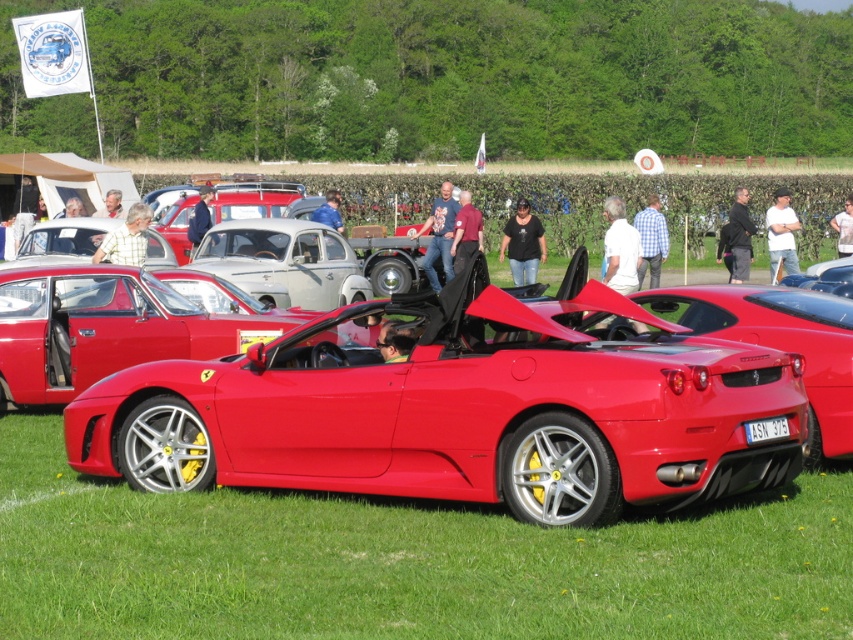
You are a photographer at the car show and want to take a photo of both the shiny red sports car at center and the glossy red convertible at center. Which car should you focus on first to ensure it appears clearer in the photo?

The shiny red sports car at center is closer to the viewer than the glossy red convertible at center, so focusing on it first will ensure it appears clearer in the photo.

You are standing at point (x=242, y=337) and want to walk to point (x=669, y=444). Which direction should you move?

You should move forward because point (x=669, y=444) is in front of point (x=242, y=337).

You are standing at the point closest to the Ferrari sports car. There are two points marked in the image, one at coordinates point (163, 444) and another at point (621, 604). Which point is farther away from you?

Point (163, 444) is behind point (621, 604), so the point farther away from you is point (163, 444).